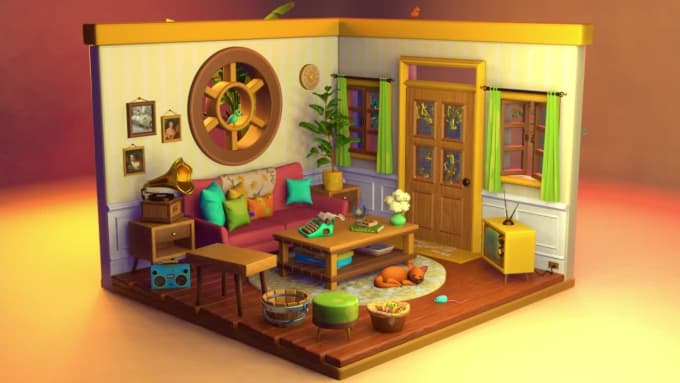
You are a GUI agent. You are given a task and a screenshot of the screen. Output one action in this format:
    pyautogui.click(x=<x>, y=<y>)
    Task: Click on the wall art
    The image size is (680, 383).
    Given the screenshot: What is the action you would take?
    pyautogui.click(x=136, y=129), pyautogui.click(x=168, y=128), pyautogui.click(x=137, y=149)